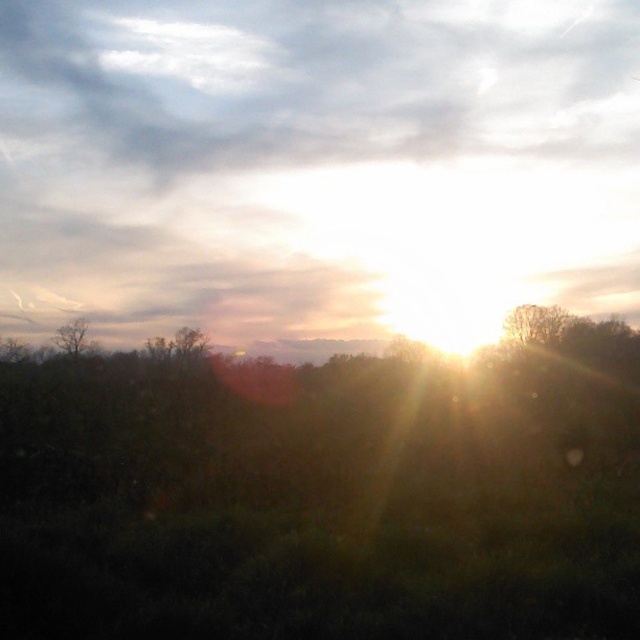
Question: Is the position of bare branches at center more distant than that of bare branches at left?

Choices:
 (A) no
 (B) yes

Answer: (A)

Question: Is bare branches at center to the right of bare branches at left from the viewer's perspective?

Choices:
 (A) no
 (B) yes

Answer: (B)

Question: Which point is closer to the camera taking this photo?

Choices:
 (A) (72, 348)
 (B) (545, 324)

Answer: (B)

Question: Is bare branches at center bigger than bare branches at left?

Choices:
 (A) yes
 (B) no

Answer: (B)